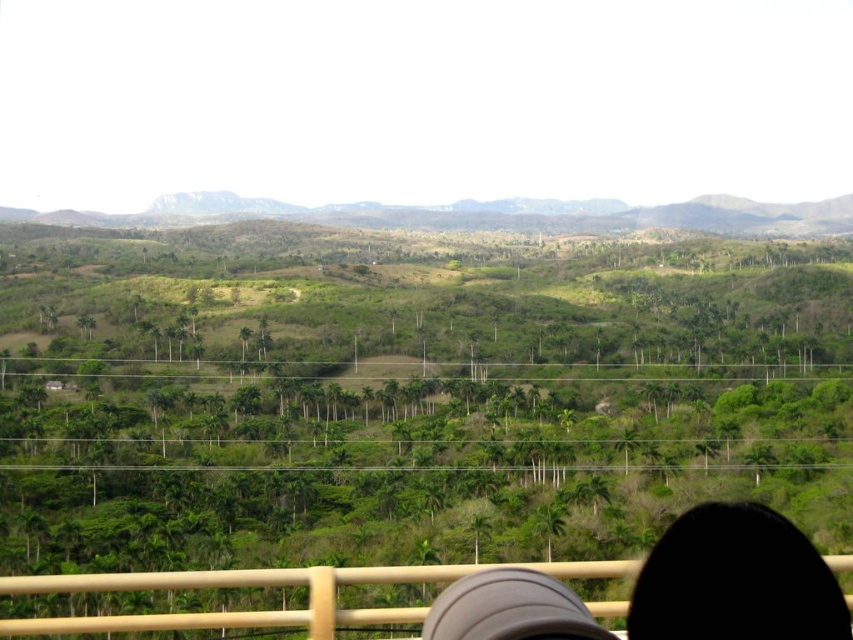
Question: Does black hair at lower right appear under green grassy hillside at upper center?

Choices:
 (A) no
 (B) yes

Answer: (B)

Question: Which of the following is the farthest from the observer?

Choices:
 (A) (654, 595)
 (B) (234, 621)

Answer: (B)

Question: Is black hair at lower right bigger than green grassy hillside at upper center?

Choices:
 (A) yes
 (B) no

Answer: (B)

Question: Is black hair at lower right bigger than green grassy hillside at upper center?

Choices:
 (A) no
 (B) yes

Answer: (A)

Question: Which point is closer to the camera taking this photo?

Choices:
 (A) (650, 216)
 (B) (119, 620)

Answer: (B)

Question: Which object is farther from the camera taking this photo?

Choices:
 (A) black hair at lower right
 (B) green grassy hillside at upper center
 (C) wooden rail at bottom

Answer: (B)